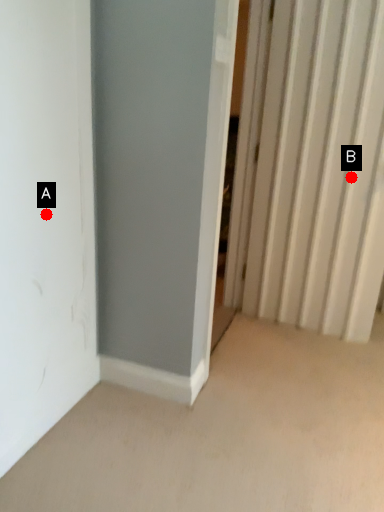
Question: Two points are circled on the image, labeled by A and B beside each circle. Which of the following is the farthest from the observer?

Choices:
 (A) A is further
 (B) B is further

Answer: (B)